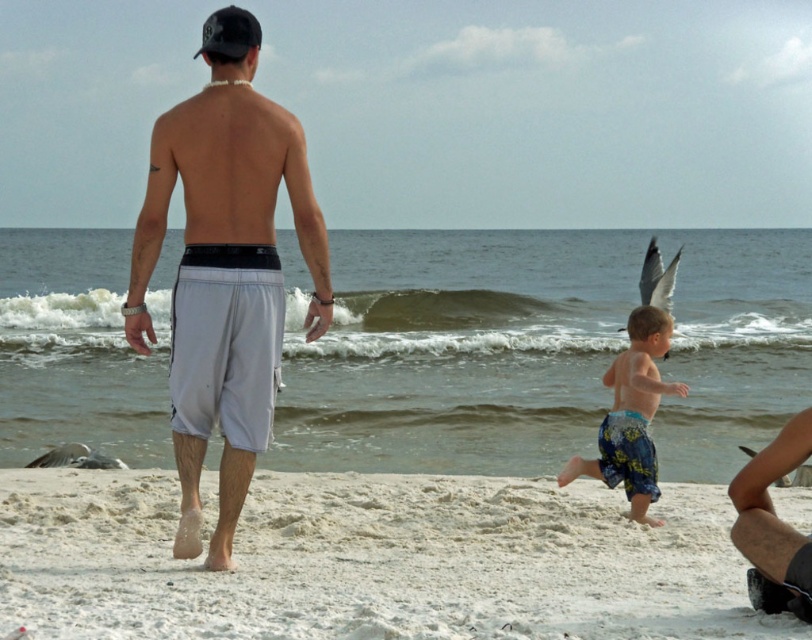
Question: Which of these objects is positioned closest to the white sandy beach at lower center?

Choices:
 (A) white matte shorts at center
 (B) blue printed shorts at center

Answer: (B)

Question: Is white matte shorts at center below blue printed shorts at center?

Choices:
 (A) yes
 (B) no

Answer: (B)

Question: Which of the following is the closest to the observer?

Choices:
 (A) blue printed shorts at center
 (B) white matte shorts at center
 (C) white sandy beach at lower center

Answer: (B)

Question: Does white sandy beach at lower center appear on the right side of blue printed shorts at center?

Choices:
 (A) no
 (B) yes

Answer: (A)

Question: Among these points, which one is nearest to the camera?

Choices:
 (A) (145, 353)
 (B) (279, 516)

Answer: (A)

Question: Does white sandy beach at lower center have a greater width compared to white matte shorts at center?

Choices:
 (A) no
 (B) yes

Answer: (B)